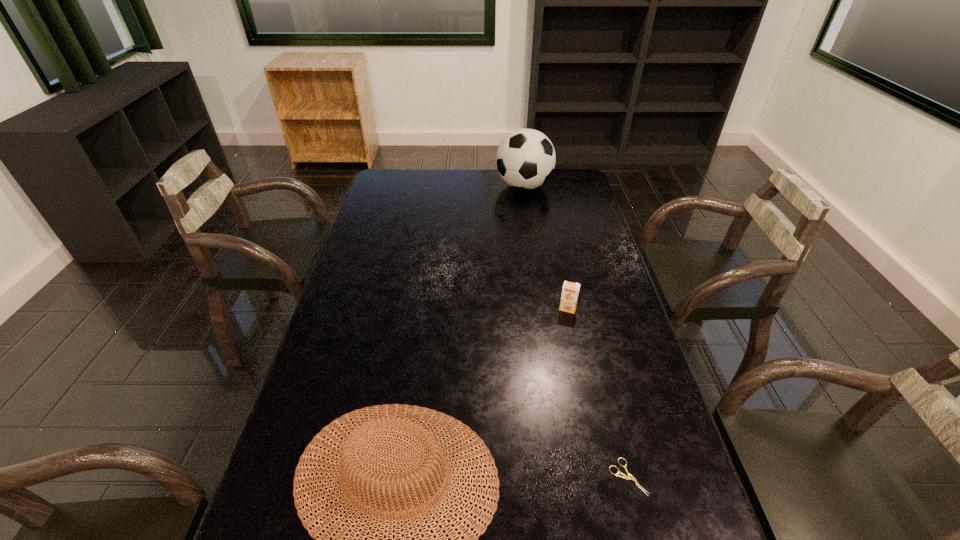
Locate an element on the screen. The image size is (960, 540). orange juice present at the right edge is located at coordinates (570, 290).

Locate an element on the screen. This screenshot has height=540, width=960. shears that is at the right edge is located at coordinates (624, 476).

Find the location of a particular element. The width and height of the screenshot is (960, 540). object at the far right corner is located at coordinates (525, 159).

This screenshot has width=960, height=540. Identify the location of vacant space at the far edge of the desktop. (441, 170).

I want to click on free spot at the left edge of the desktop, so click(334, 323).

In the image, there is a desktop. Identify the location of free space at the right edge. The width and height of the screenshot is (960, 540). (658, 414).

The image size is (960, 540). In the image, there is a desktop. In order to click on blank space at the far left corner in this screenshot , I will do `click(386, 188)`.

Locate an element on the screen. blank region between the third tallest object and the shears is located at coordinates (597, 393).

Where is `empty location between the soccer ball and the shortest object`? This screenshot has width=960, height=540. empty location between the soccer ball and the shortest object is located at coordinates (576, 332).

This screenshot has height=540, width=960. What are the coordinates of `empty location between the tallest object and the shortest object` in the screenshot? It's located at (576, 332).